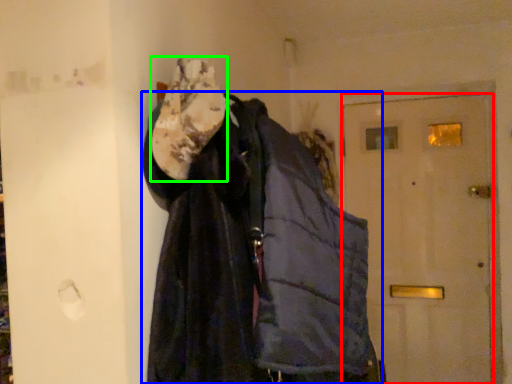
Question: Which object is positioned closest to door (highlighted by a red box)? Select from jacket (highlighted by a blue box) and scarf (highlighted by a green box).

Choices:
 (A) jacket
 (B) scarf

Answer: (A)